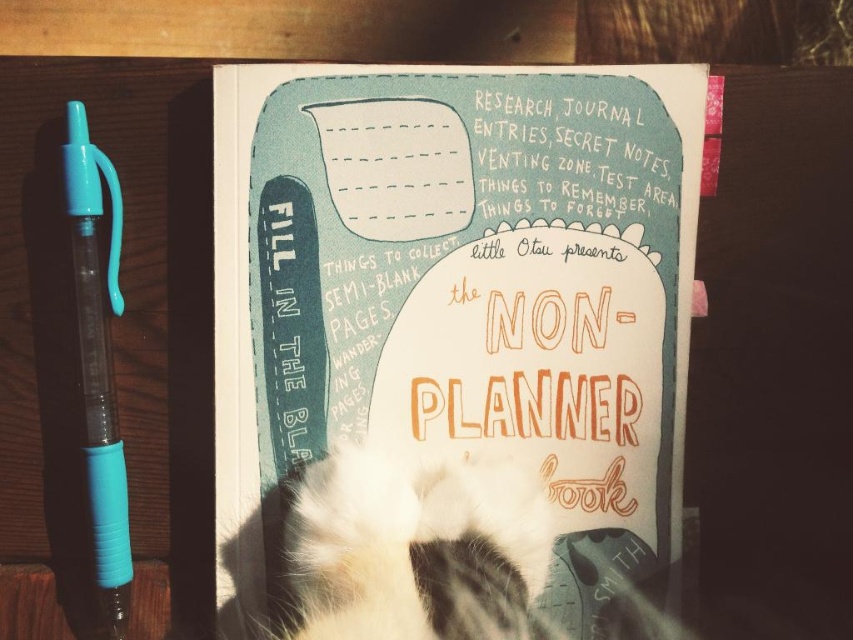
You have a fluffy white fur at center and a translucent blue plastic pen at left. Which object is wider?

The fluffy white fur at center is wider than the translucent blue plastic pen at left.

You have a matte paper journal at center and a translucent blue plastic pen at left. Which object is bigger?

The matte paper journal at center is larger than the translucent blue plastic pen at left.

You are organizing your desk and notice the fluffy white fur at center and the translucent blue plastic pen at left. Which object takes up more space on your desk?

The fluffy white fur at center has a larger size compared to the translucent blue plastic pen at left, so it takes up more space on the desk.